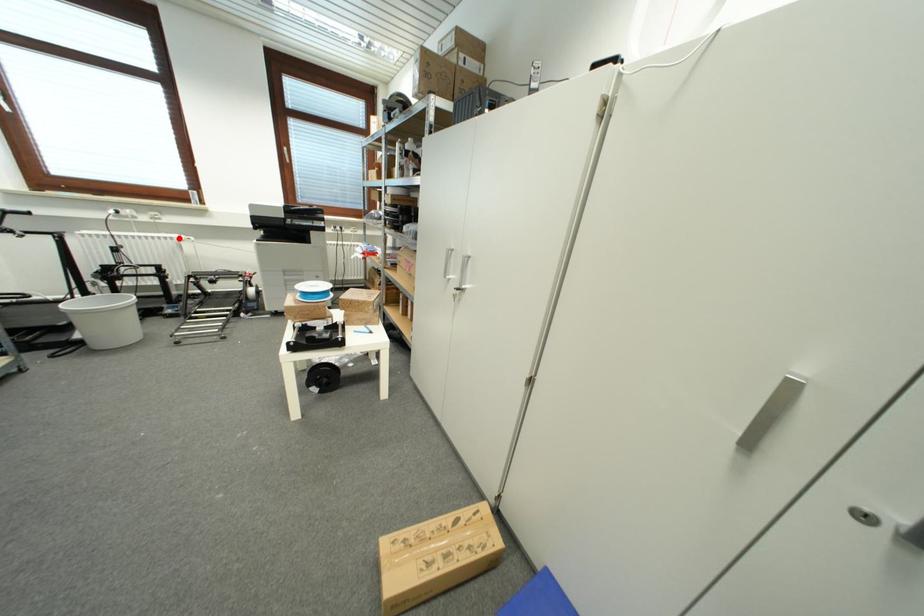
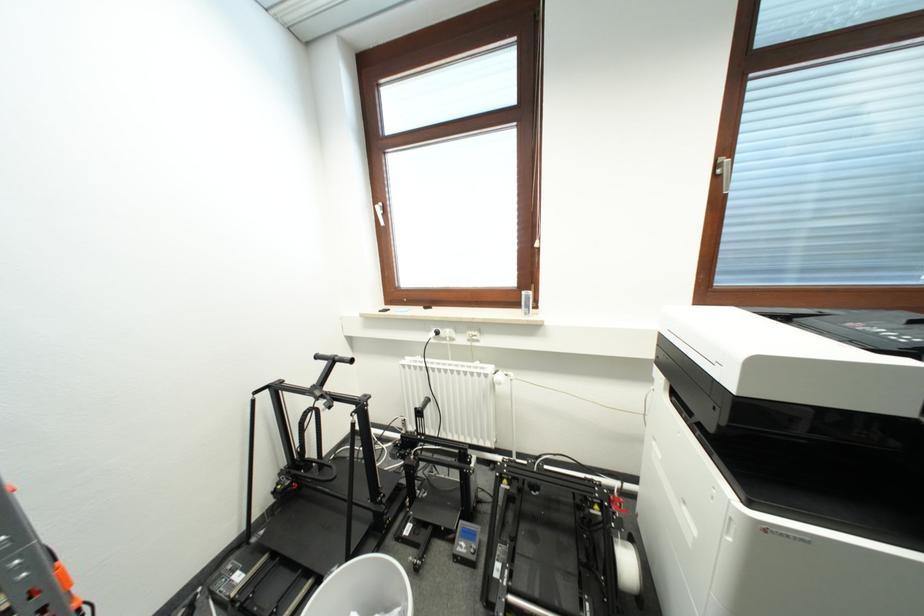
The point at the highlighted location is marked in the first image. Where is the corresponding point in the second image?

(494, 371)